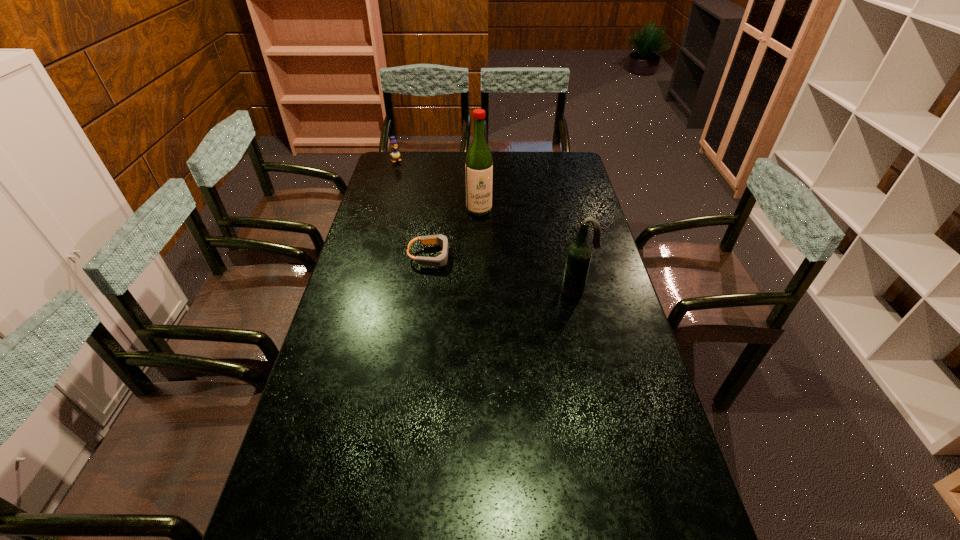
Identify the location of vacant space at the far edge of the desktop. (495, 163).

In order to click on vacant space at the near edge in this screenshot , I will do `click(497, 514)`.

This screenshot has width=960, height=540. Identify the location of vacant space at the left edge of the desktop. (365, 335).

At what (x,y) coordinates should I click in order to perform the action: click on free space at the right edge of the desktop. Please return your answer as a coordinate pair (x, y). Image resolution: width=960 pixels, height=540 pixels. Looking at the image, I should click on (588, 312).

In the image, there is a desktop. At what (x,y) coordinates should I click in order to perform the action: click on free space at the far left corner. Please return your answer as a coordinate pair (x, y). The image size is (960, 540). Looking at the image, I should click on 407,173.

Where is `unoccupied position between the third nearest object and the farthest object`? The height and width of the screenshot is (540, 960). unoccupied position between the third nearest object and the farthest object is located at coordinates (438, 185).

Find the location of a particular element. This screenshot has width=960, height=540. unoccupied position between the second tallest object and the third tallest object is located at coordinates 487,226.

Where is `unoccupied position between the duckling and the goggles`? This screenshot has height=540, width=960. unoccupied position between the duckling and the goggles is located at coordinates (414, 208).

I want to click on vacant space that's between the rightmost object and the shortest object, so click(504, 274).

The height and width of the screenshot is (540, 960). I want to click on free space between the rightmost object and the duckling, so click(487, 226).